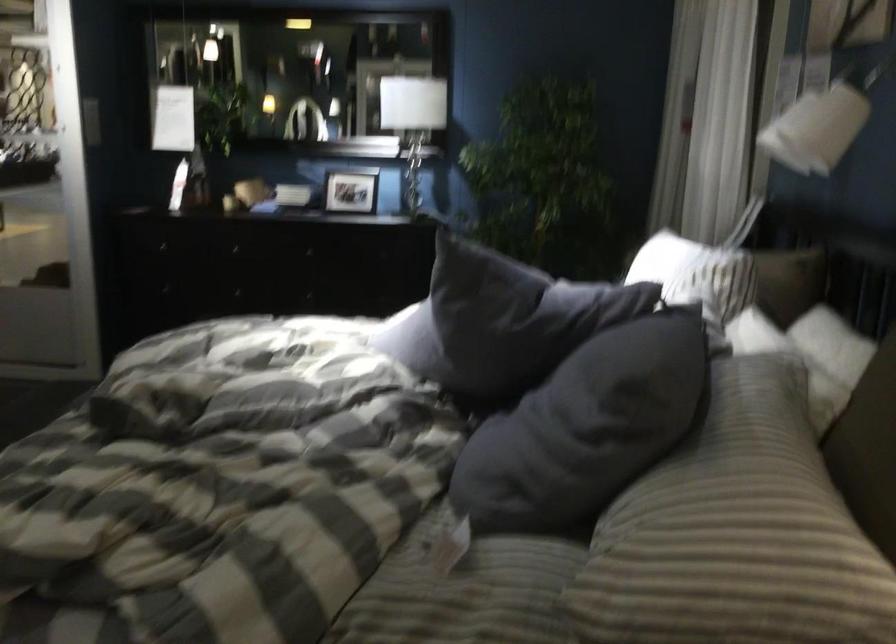
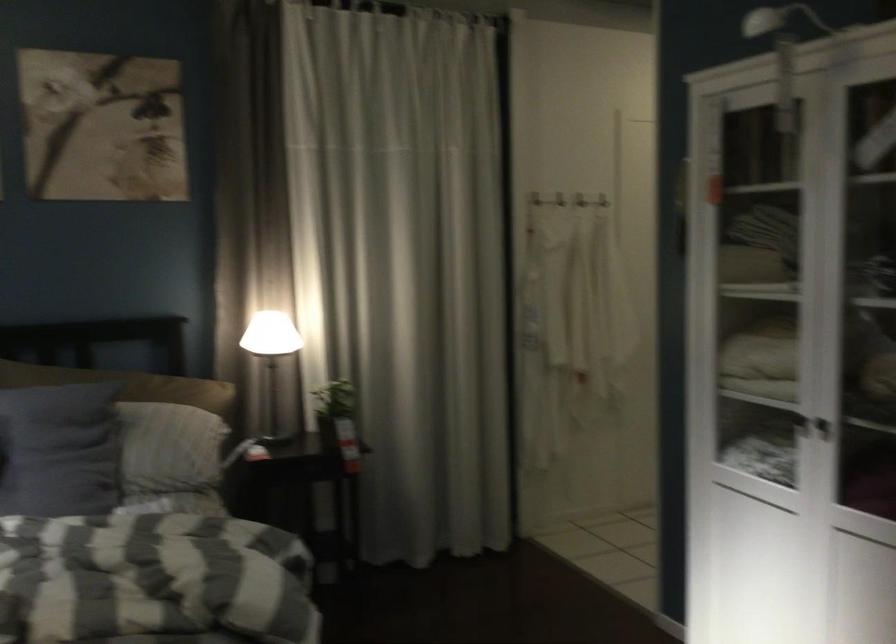
In the second image, find the point that corresponds to (578,413) in the first image.

(58, 450)